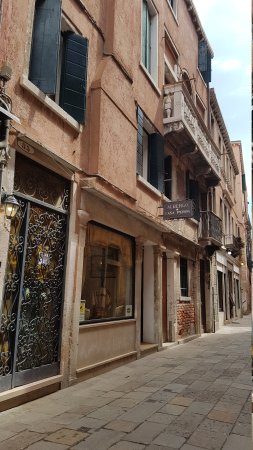
In order to click on curtains in this screenshot , I will do `click(96, 235)`.